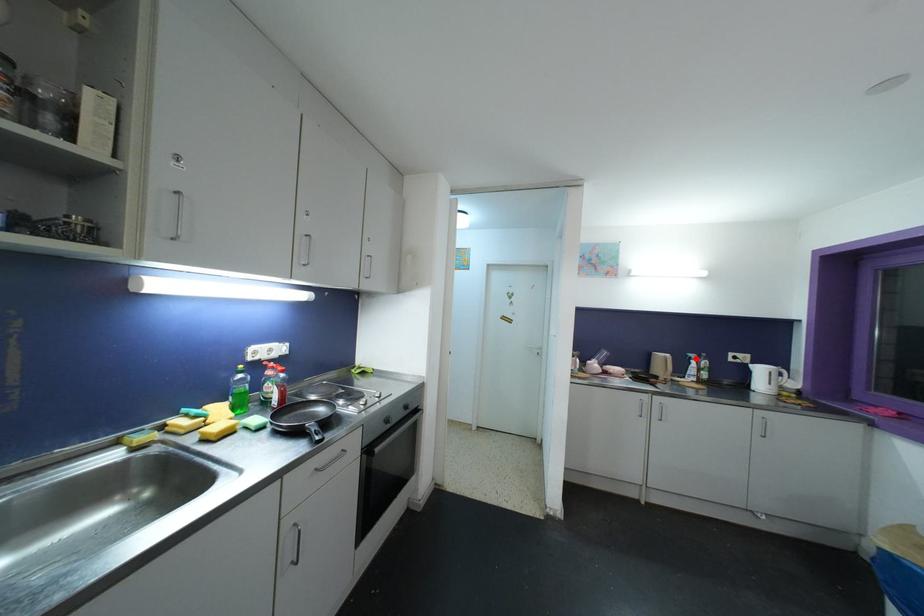
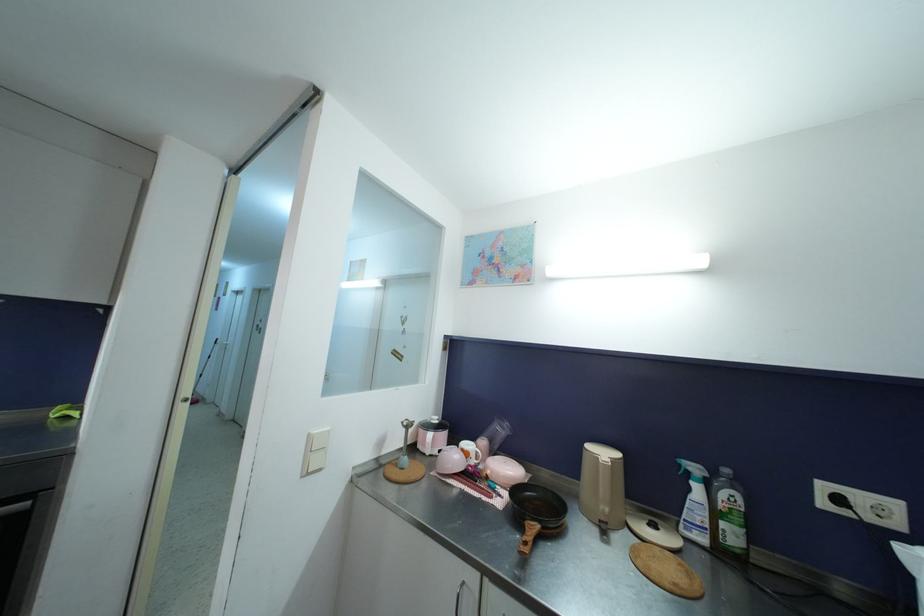
Find the pixel in the second image that matches the highlighted location in the first image.

(699, 472)